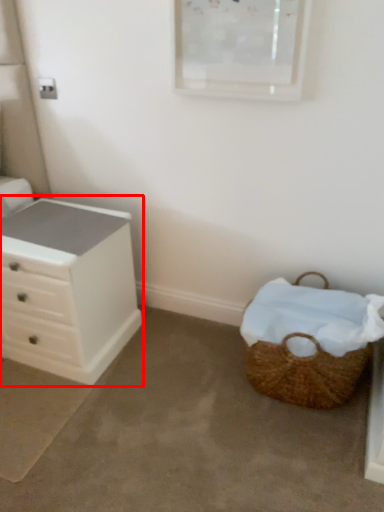
Question: Where is chest of drawers (annotated by the red box) located in relation to picnic basket in the image?

Choices:
 (A) left
 (B) right

Answer: (A)